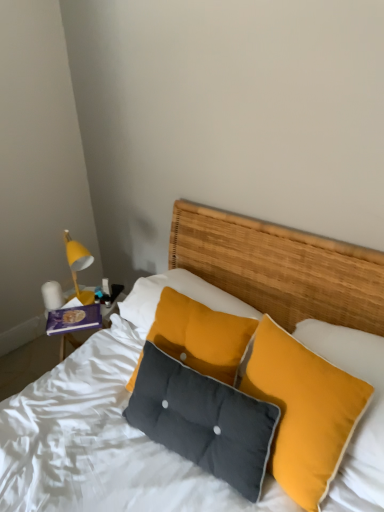
Question: Looking at their shapes, would you say textured woven headboard at center is wider or thinner than dark gray fabric pillow at center, the second pillow when ordered from right to left?

Choices:
 (A) thin
 (B) wide

Answer: (B)

Question: Relative to dark gray fabric pillow at center, the second pillow when ordered from right to left, is textured woven headboard at center in front or behind?

Choices:
 (A) behind
 (B) front

Answer: (A)

Question: Which is farther from the textured yellow pillow at center, arranged as the first pillow when viewed from the right?

Choices:
 (A) textured woven headboard at center
 (B) white glossy lamp at left
 (C) yellow matte lampshade at left
 (D) dark gray fabric pillow at center, positioned as the first pillow in left-to-right order

Answer: (B)

Question: Which is nearer to the white glossy lamp at left?

Choices:
 (A) textured yellow pillow at center, which ranks as the 2th pillow in left-to-right order
 (B) dark gray fabric pillow at center, the second pillow when ordered from right to left
 (C) yellow matte lampshade at left
 (D) textured woven headboard at center

Answer: (C)